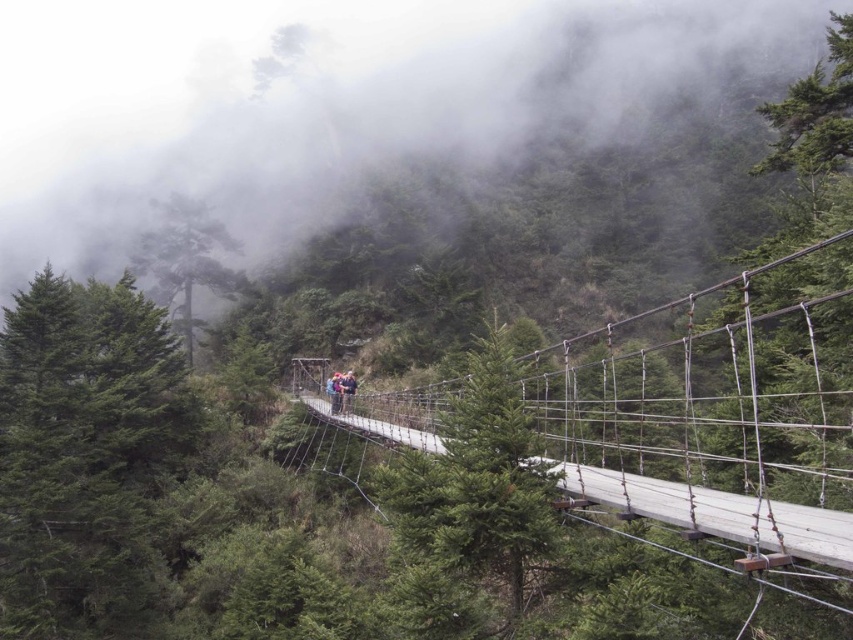
Can you confirm if white foggy cloud at upper center is positioned to the left of wooden suspension bridge at center?

Correct, you'll find white foggy cloud at upper center to the left of wooden suspension bridge at center.

You are a GUI agent. You are given a task and a screenshot of the screen. Output one action in this format:
    pyautogui.click(x=<x>, y=<y>)
    Task: Click on the white foggy cloud at upper center
    
    Given the screenshot: What is the action you would take?
    pyautogui.click(x=323, y=100)

Does wooden suspension bridge at center have a greater width compared to dark blue jeans at center?

Yes, wooden suspension bridge at center is wider than dark blue jeans at center.

Which is more to the right, wooden suspension bridge at center or dark blue jeans at center?

wooden suspension bridge at center

Where is `wooden suspension bridge at center`? Image resolution: width=853 pixels, height=640 pixels. wooden suspension bridge at center is located at coordinates (712, 422).

Image resolution: width=853 pixels, height=640 pixels. What are the coordinates of `wooden suspension bridge at center` in the screenshot? It's located at (712, 422).

Is point (347, 193) closer to camera compared to point (344, 376)?

No, (347, 193) is further to viewer.

Looking at this image, is white foggy cloud at upper center shorter than dark blue jeans at center?

Incorrect, white foggy cloud at upper center's height does not fall short of dark blue jeans at center's.

Describe the element at coordinates (323, 100) in the screenshot. I see `white foggy cloud at upper center` at that location.

Locate an element on the screen. Image resolution: width=853 pixels, height=640 pixels. white foggy cloud at upper center is located at coordinates (323, 100).